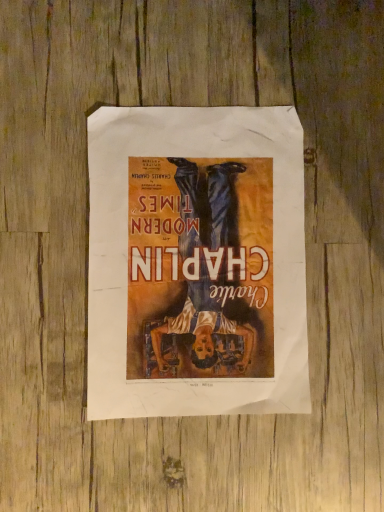
The height and width of the screenshot is (512, 384). What do you see at coordinates (196, 262) in the screenshot? I see `matte paper poster at center` at bounding box center [196, 262].

Measure the distance between matte paper poster at center and camera.

15.50 inches.

What are the coordinates of `matte paper poster at center` in the screenshot? It's located at (196, 262).

In order to click on matte paper poster at center in this screenshot , I will do `click(196, 262)`.